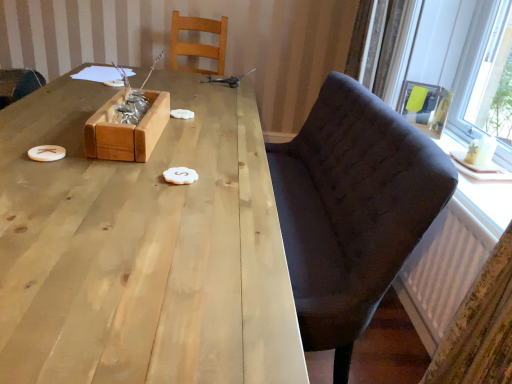
Locate an element on the screen. vacant space that's between white matte cookie at center, the second food in the left-to-right sequence, and white matte cookie at center, the first food in the left-to-right sequence is located at coordinates (179, 144).